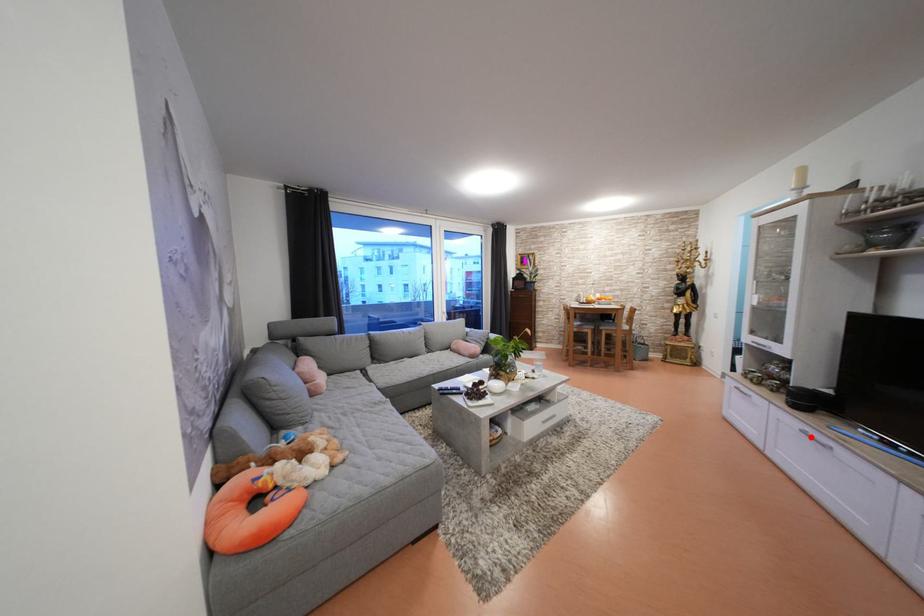
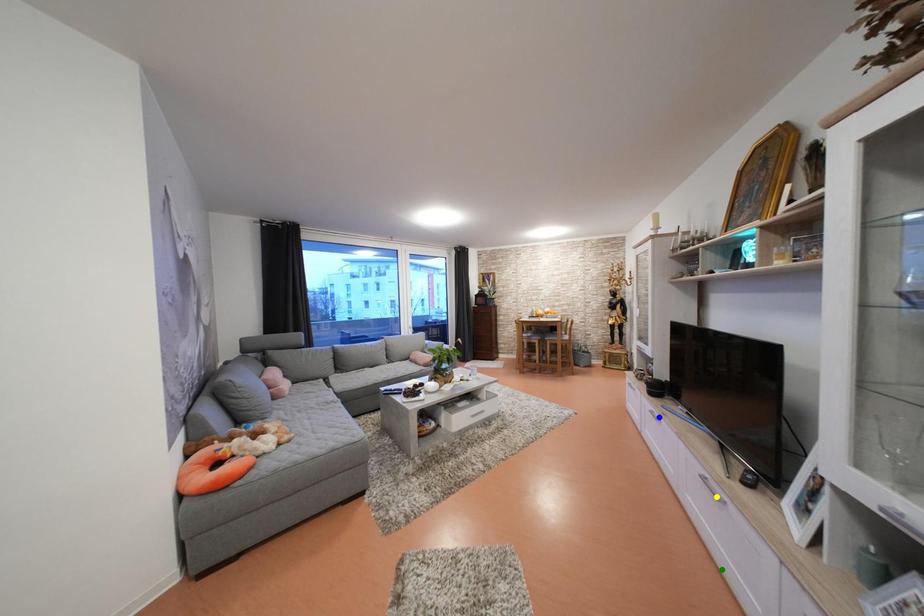
Question: I am providing you with two images of the same scene from different viewpoints. A red point is marked on the first image. You are given multiple points on the second image. Which point in image 2 represents the same 3d spot as the red point in image 1?

Choices:
 (A) blue point
 (B) yellow point
 (C) green point

Answer: (A)